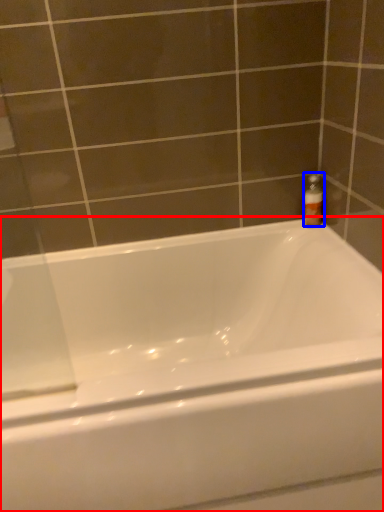
Question: Among these objects, which one is farthest to the camera, bathtub (highlighted by a red box) or bottle (highlighted by a blue box)?

Choices:
 (A) bathtub
 (B) bottle

Answer: (B)